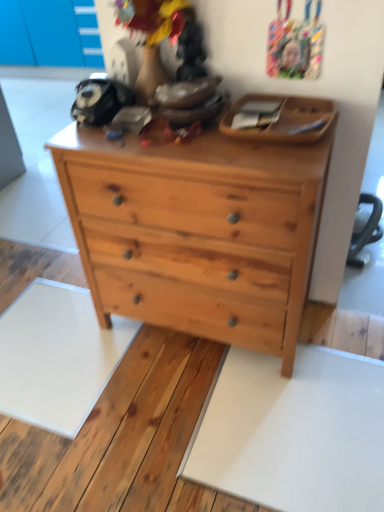
Describe the element at coordinates (197, 232) in the screenshot. I see `natural wood chest of drawers at center` at that location.

You are a GUI agent. You are given a task and a screenshot of the screen. Output one action in this format:
    pyautogui.click(x=<x>, y=<y>)
    Task: Click on the natural wood chest of drawers at center
    
    Given the screenshot: What is the action you would take?
    pyautogui.click(x=197, y=232)

What is the approximate width of natural wood chest of drawers at center?

The width of natural wood chest of drawers at center is 16.98 inches.

The width and height of the screenshot is (384, 512). In order to click on natural wood chest of drawers at center in this screenshot , I will do `click(197, 232)`.